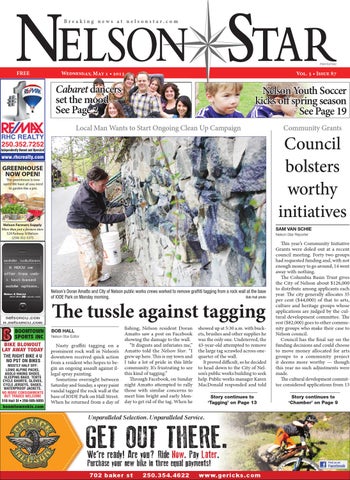
Locate an element on the screen. The image size is (350, 480). white bucket is located at coordinates (113, 247).